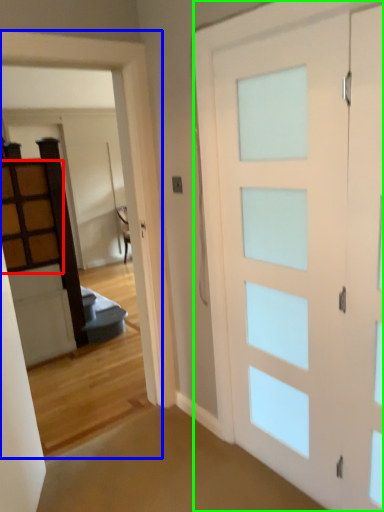
Question: Estimate the real-world distances between objects in this image. Which object is farther from cabinetry (highlighted by a red box), garage door (highlighted by a blue box) or barn door (highlighted by a green box)?

Choices:
 (A) garage door
 (B) barn door

Answer: (B)